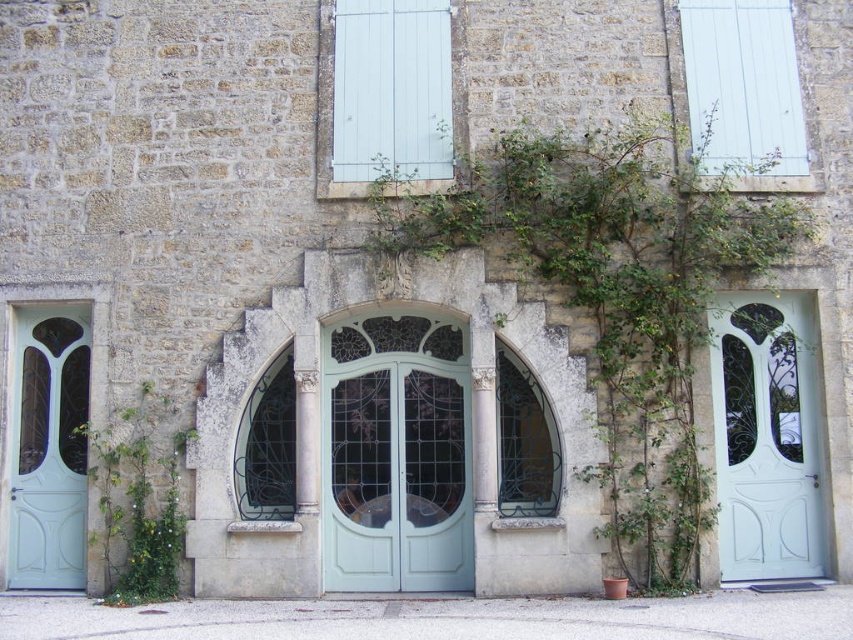
Between green glass window at center and dark glass window at center, which one is positioned lower?

dark glass window at center is lower down.

Is green glass window at center further to camera compared to dark glass window at center?

That is True.

Between point (532, 394) and point (279, 404), which one is positioned behind?

The point (279, 404) is behind.

Where is `green glass window at center`? green glass window at center is located at coordinates (525, 440).

Find the location of a particular element. This screenshot has height=640, width=853. light green wood door at center is located at coordinates (396, 456).

Does light green wood door at center have a lesser width compared to green glass window at center?

Incorrect, light green wood door at center's width is not less than green glass window at center's.

Image resolution: width=853 pixels, height=640 pixels. In order to click on light green wood door at center in this screenshot , I will do `click(396, 456)`.

Can you confirm if green leafy plant at center is taller than white painted wood at upper center?

Correct, green leafy plant at center is much taller as white painted wood at upper center.

At what (x,y) coordinates should I click in order to perform the action: click on green leafy plant at center. Please return your answer as a coordinate pair (x, y). Image resolution: width=853 pixels, height=640 pixels. Looking at the image, I should click on (614, 292).

Find the location of `green leafy plant at center`. green leafy plant at center is located at coordinates (614, 292).